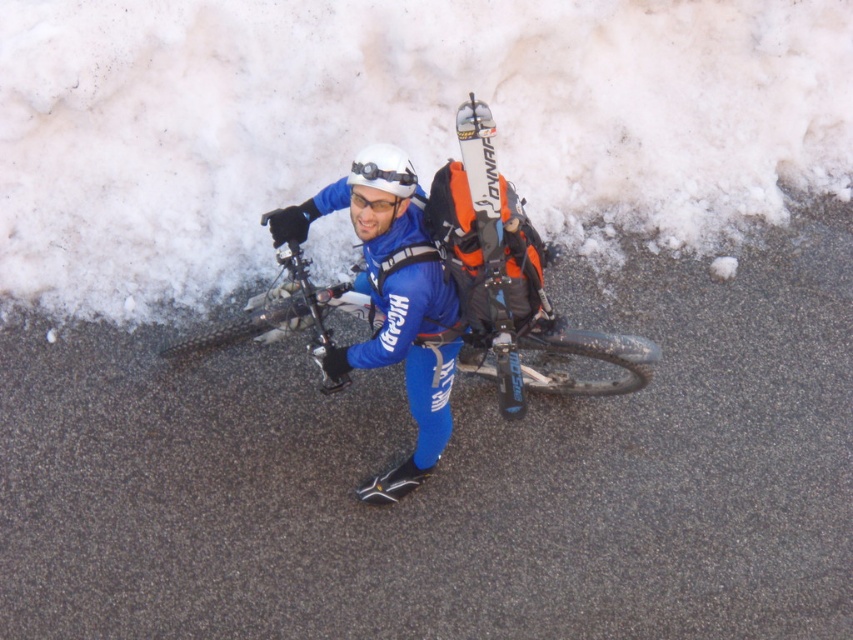
Does blue matte/synthetic suit at center appear under white matte goggles at center?

Yes, blue matte/synthetic suit at center is below white matte goggles at center.

Based on the photo, is blue matte/synthetic suit at center smaller than white matte goggles at center?

Incorrect, blue matte/synthetic suit at center is not smaller in size than white matte goggles at center.

Find the location of a particular element. blue matte/synthetic suit at center is located at coordinates (393, 314).

Is point (502, 378) more distant than point (358, 168)?

Yes, it is behind point (358, 168).

Can you confirm if white matte ski at center is positioned above white matte goggles at center?

No, white matte ski at center is not above white matte goggles at center.

Is point (495, 328) farther from camera compared to point (370, 166)?

Yes, point (495, 328) is farther from viewer.

The image size is (853, 640). Find the location of `white matte ski at center`. white matte ski at center is located at coordinates (490, 244).

Which of these two, white matte helmet at center or white matte goggles at center, stands shorter?

With less height is white matte goggles at center.

Which is behind, point (397, 204) or point (402, 176)?

The point (397, 204) is more distant.

Is point (390, 166) positioned before point (355, 168)?

Yes, point (390, 166) is closer to viewer.

Find the location of a particular element. white matte helmet at center is located at coordinates (379, 188).